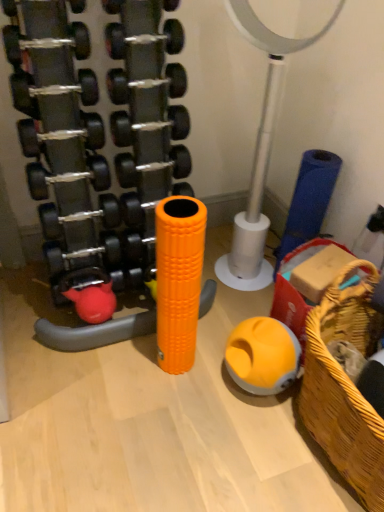
Find the location of a particular element. The height and width of the screenshot is (512, 384). free space to the left of rubberized yellow ball at center, which appears as the second toy when viewed from the left is located at coordinates (205, 384).